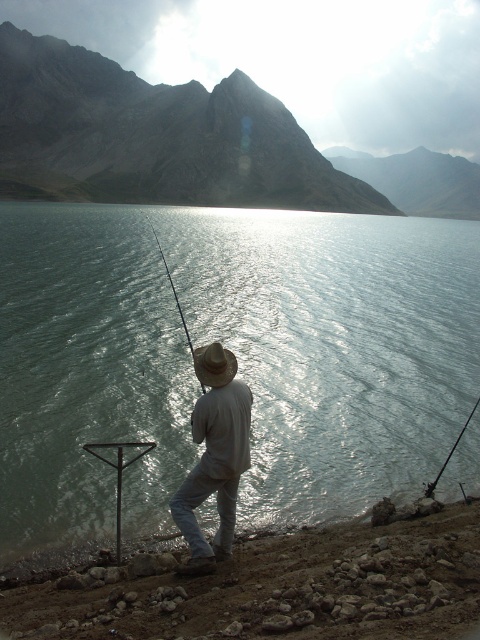
You are a hiker who just arrived at the lakeside. You need to place a 100 feet long tent between the dull brown dirt at lower right and the shiny metallic fishing pole at center. Is there enough space between them to set up the tent?

The distance between the dull brown dirt at lower right and the shiny metallic fishing pole at center is 98.56 feet, which is slightly shorter than the 100 feet required for the tent. Therefore, there is not enough space to set up the tent between them.

You are a photographer trying to capture the reflection of the mountains in the lake. You notice the shiny metallic fishing pole at center and the smooth black rod at center. Which object might be blocking the reflection of the mountains in the lake?

The shiny metallic fishing pole at center is blocking the reflection because it is in front of the smooth black rod at center, which is closer to the photographer.

Consider the image. You are a photographer aiming to capture the fisherman and their equipment in the scene. Since you want to highlight the fisherman and the fishing rod, where should you position the brown woven straw hat at center relative to the smooth black rod at center in your composition?

The brown woven straw hat at center is to the left of the smooth black rod at center, so positioning it to the left side of the rod in your composition will accurately reflect their arrangement in the scene.